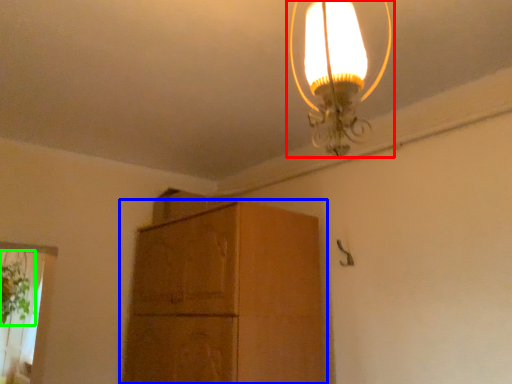
Question: Considering the real-world distances, which object is closest to lamp (highlighted by a red box)? cabinetry (highlighted by a blue box) or plant (highlighted by a green box).

Choices:
 (A) cabinetry
 (B) plant

Answer: (A)